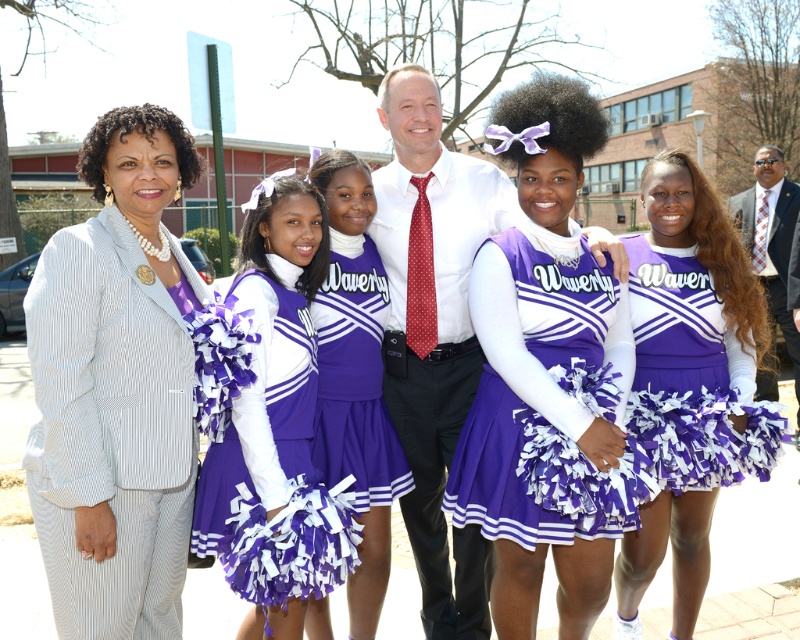
What are the coordinates of the purple matte cheerleader at center?

The purple matte cheerleader at center is located at coordinates point (692,289).